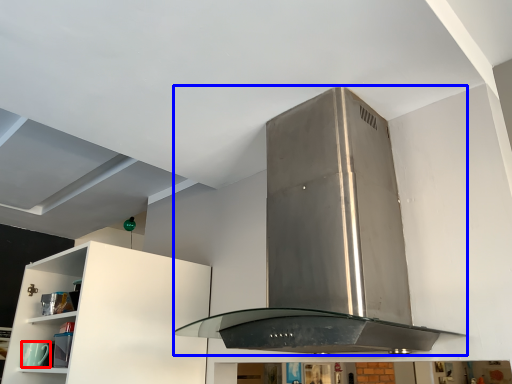
Question: Which point is further to the camera, appliance (highlighted by a red box) or home appliance (highlighted by a blue box)?

Choices:
 (A) appliance
 (B) home appliance

Answer: (A)